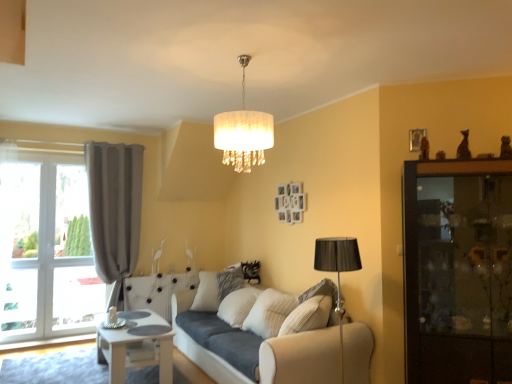
This screenshot has height=384, width=512. Find the location of `free point above white fabric lampshade at center (from a real-world perspective)`. free point above white fabric lampshade at center (from a real-world perspective) is located at coordinates (243, 59).